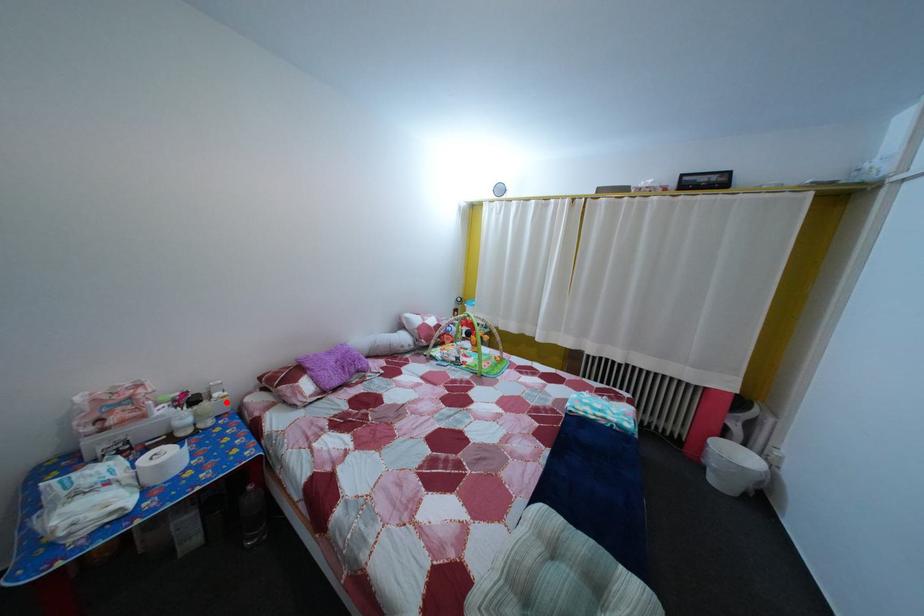
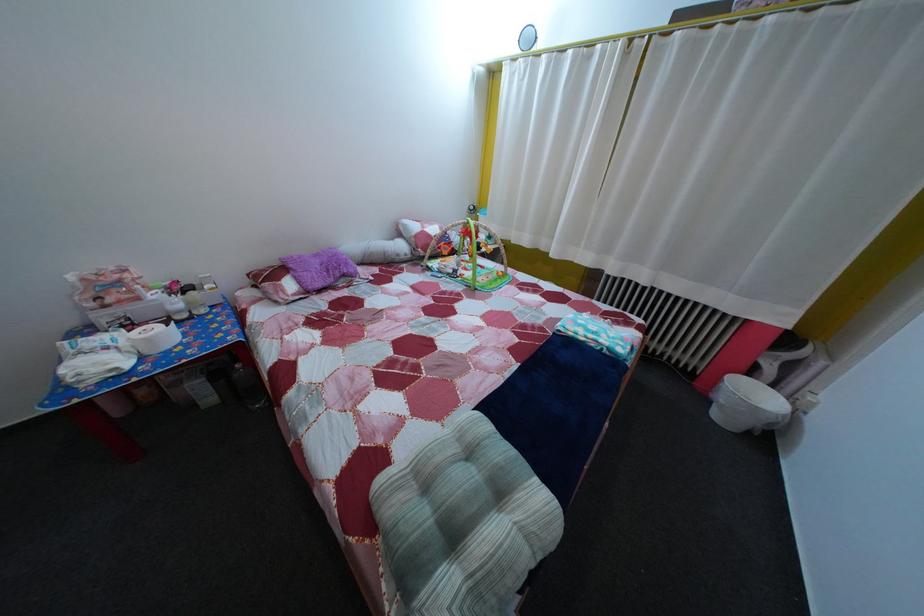
The point at the highlighted location is marked in the first image. Where is the corresponding point in the second image?

(216, 294)